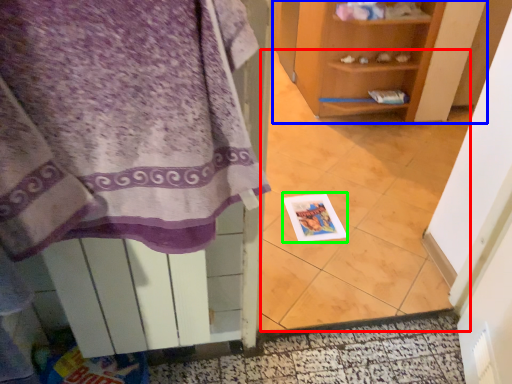
Question: Which object is positioned closest to tile (highlighted by a red box)? Select from shelf (highlighted by a blue box) and postcard (highlighted by a green box).

Choices:
 (A) shelf
 (B) postcard

Answer: (B)